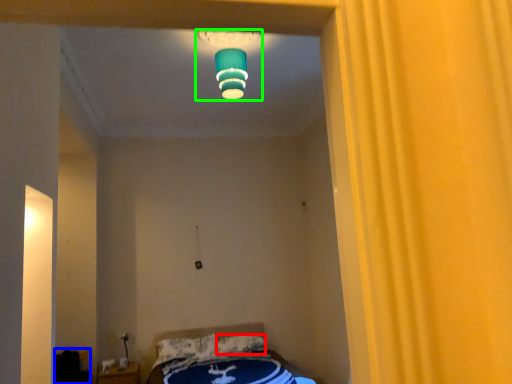
Question: Based on their relative distances, which object is nearer to pillow (highlighted by a red box)? Choose from furniture (highlighted by a blue box) and lamp (highlighted by a green box).

Choices:
 (A) furniture
 (B) lamp

Answer: (A)